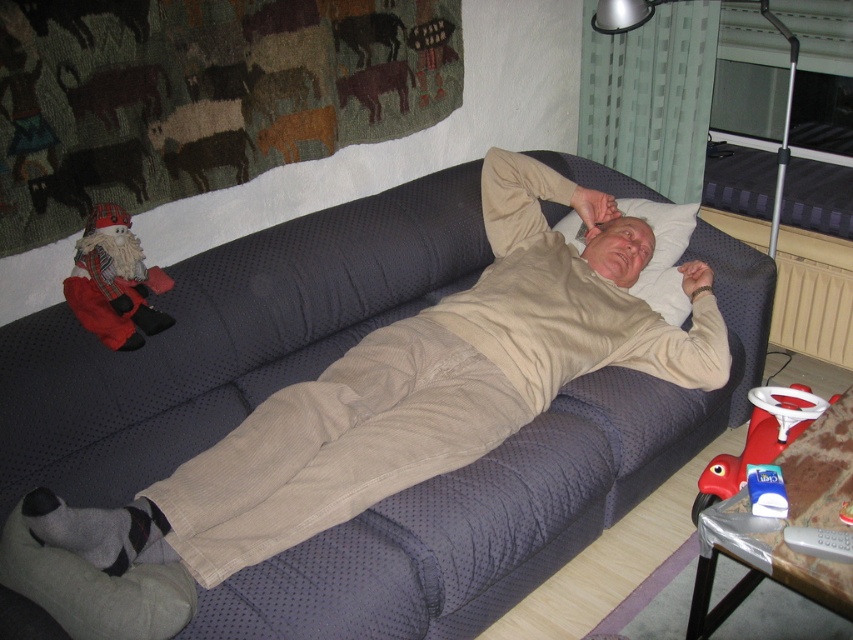
In the scene shown: You are a delivery robot that is 1.2 meters tall. You are standing in the living room and need to place a package on the dark blue textured couch at center. Can you reach the top of the couch to place the package?

The dark blue textured couch at center and viewer are 1.46 meters apart. Since the robot is 1.2 meters tall, it may not be able to reach the top of the couch unless it can extend its arm or stand on something.

Where is the dark blue textured couch at center located in the image?

The dark blue textured couch at center is located at point [225,339] in the image.

Consider the image. You are a guest in this living room and want to sit down on the dark blue textured couch at center. However, there is a white soft pillow at upper center in the way. Can you move the pillow to the right to make space?

The dark blue textured couch at center is to the left of the white soft pillow at upper center, so moving the pillow to the right would clear space on the couch.